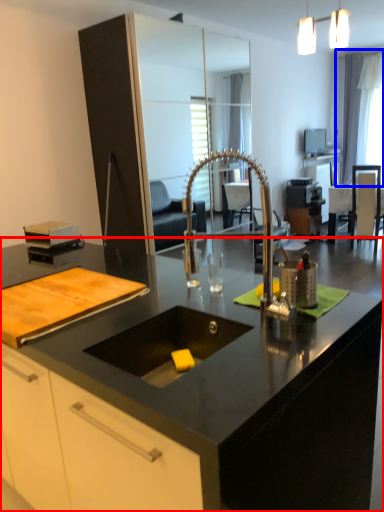
Question: Which object is closer to the camera taking this photo, countertop (highlighted by a red box) or window screen (highlighted by a blue box)?

Choices:
 (A) countertop
 (B) window screen

Answer: (A)